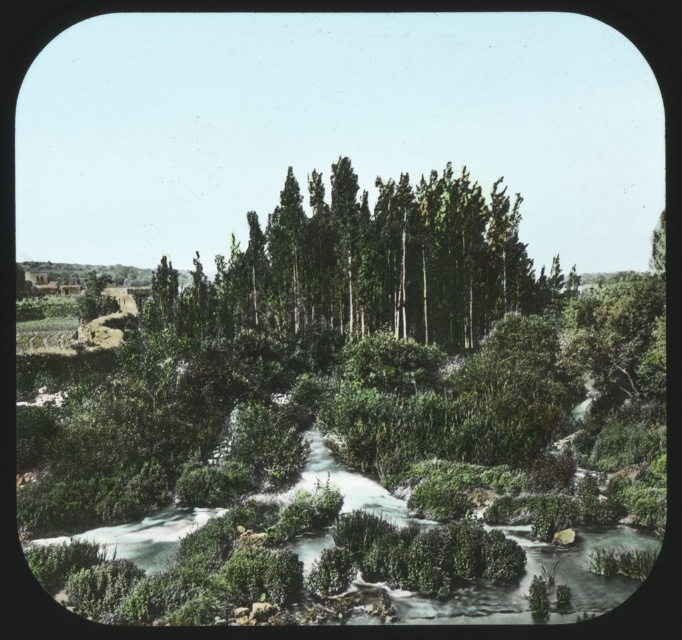
You are standing at the point with coordinates point (376, 284) and want to walk towards the point with coordinates point (454, 500). Which direction should you move to reach the other point?

You should move forward because point (454, 500) is in front of point (376, 284).

You are a hiker trying to cross the stream. You see the green mossy river at center and the green smooth trees at center. Which one do you need to step over to reach the other side?

The green mossy river at center is larger in size than the green smooth trees at center, so you need to step over the green mossy river at center to reach the other side.

You are standing at the edge of the green mossy river at center and want to reach the green smooth trees at center. Which direction should you move to get closer to the trees?

You should move forward because the green mossy river at center is closer to you than the green smooth trees at center, so moving towards them would bring you nearer.